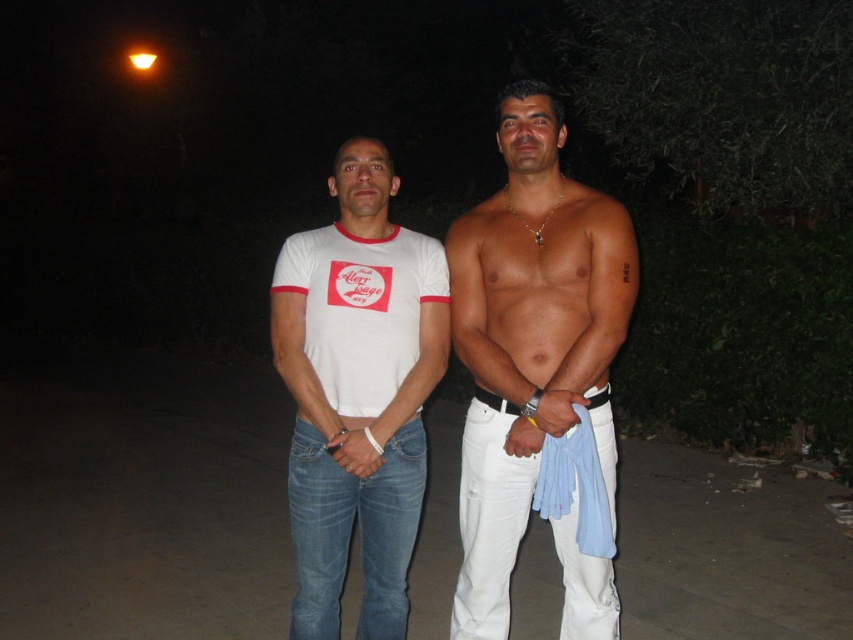
Does white cotton t-shirt at center appear over black leather belt at center?

Indeed, white cotton t-shirt at center is positioned over black leather belt at center.

Can you confirm if white cotton t-shirt at center is positioned to the right of black leather belt at center?

No, white cotton t-shirt at center is not to the right of black leather belt at center.

Between point (312, 576) and point (602, 400), which one is positioned in front?

Positioned in front is point (602, 400).

At what (x,y) coordinates should I click in order to perform the action: click on white cotton t-shirt at center. Please return your answer as a coordinate pair (x, y). Looking at the image, I should click on (357, 392).

Which of these two, white ringer t-shirt at center or black leather belt at center, stands shorter?

Standing shorter between the two is black leather belt at center.

Does white ringer t-shirt at center have a greater width compared to black leather belt at center?

Yes, white ringer t-shirt at center is wider than black leather belt at center.

Who is more distant from viewer, [328,312] or [485,390]?

Positioned behind is point [328,312].

Image resolution: width=853 pixels, height=640 pixels. Find the location of `white ringer t-shirt at center`. white ringer t-shirt at center is located at coordinates (361, 308).

Is smooth white pants at center positioned before black leather belt at center?

That is True.

Can you confirm if smooth white pants at center is positioned below black leather belt at center?

Actually, smooth white pants at center is above black leather belt at center.

Which is in front, point (462, 326) or point (508, 413)?

Point (508, 413)

Image resolution: width=853 pixels, height=640 pixels. I want to click on smooth white pants at center, so click(527, 336).